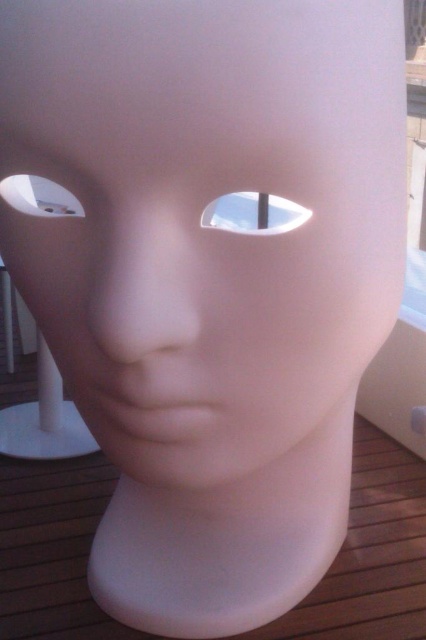
Question: Is white glossy eye at center below white matte hole at left?

Choices:
 (A) yes
 (B) no

Answer: (B)

Question: In this image, where is white glossy eye at center located relative to white matte hole at left?

Choices:
 (A) right
 (B) left

Answer: (A)

Question: Which of the following is the farthest from the observer?

Choices:
 (A) (31, 196)
 (B) (230, 224)

Answer: (B)

Question: Which of the following is the closest to the observer?

Choices:
 (A) white matte hole at left
 (B) white glossy eye at center

Answer: (A)

Question: Is white glossy eye at center wider than white matte hole at left?

Choices:
 (A) no
 (B) yes

Answer: (B)